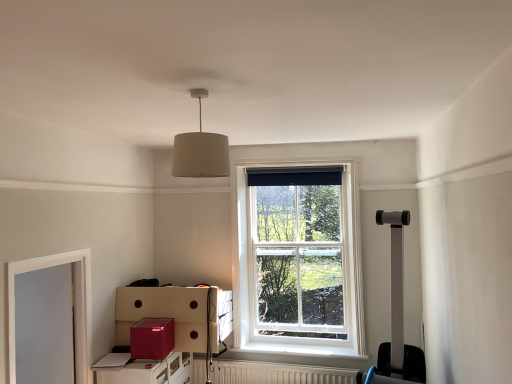
You are a GUI agent. You are given a task and a screenshot of the screen. Output one action in this format:
    pyautogui.click(x=<x>, y=<y>)
    Task: Click on the white textured radiator at lower center
    The width and height of the screenshot is (512, 384).
    Given the screenshot: What is the action you would take?
    pyautogui.click(x=278, y=373)

Where is `white wood frame at left`? The height and width of the screenshot is (384, 512). white wood frame at left is located at coordinates (81, 296).

This screenshot has height=384, width=512. What do you see at coordinates (152, 338) in the screenshot?
I see `glossy cardboard box at lower left` at bounding box center [152, 338].

Where is `beige fabric lampshade at upper center`? Image resolution: width=512 pixels, height=384 pixels. beige fabric lampshade at upper center is located at coordinates (200, 149).

Measure the distance between point (190, 358) and camera.

They are 3.76 meters apart.

This screenshot has height=384, width=512. I want to click on white textured radiator at lower center, so click(278, 373).

Where is `window in front of the dark blue fabric at upper center`? The image size is (512, 384). window in front of the dark blue fabric at upper center is located at coordinates (298, 258).

Is dark blue fabric at upper center inside or outside of white wooden window at center?

dark blue fabric at upper center is enclosed within white wooden window at center.

From the image's perspective, is dark blue fabric at upper center located beneath white wooden window at center?

Incorrect, from the image's perspective, dark blue fabric at upper center is higher than white wooden window at center.

Is dark blue fabric at upper center positioned beyond the bounds of glossy cardboard box at lower left?

Yes, dark blue fabric at upper center is not within glossy cardboard box at lower left.

Between dark blue fabric at upper center and glossy cardboard box at lower left, which one has more height?

glossy cardboard box at lower left.

From the image's perspective, who appears lower, dark blue fabric at upper center or glossy cardboard box at lower left?

glossy cardboard box at lower left.

Measure the distance from dark blue fabric at upper center to glossy cardboard box at lower left.

dark blue fabric at upper center is 5.64 feet away from glossy cardboard box at lower left.

Are white wooden window at center and dark blue fabric at upper center beside each other?

They are not placed beside each other.

Is dark blue fabric at upper center inside white wooden window at center?

Indeed, dark blue fabric at upper center is located within white wooden window at center.

In the scene shown: Is white wooden window at center closer to the viewer compared to dark blue fabric at upper center?

Yes.

Is beige fabric lampshade at upper center shorter than dark blue fabric at upper center?

Incorrect, the height of beige fabric lampshade at upper center does not fall short of that of dark blue fabric at upper center.

Is point (199, 128) in front of point (288, 178)?

Yes, point (199, 128) is closer to viewer.

Is beige fabric lampshade at upper center next to dark blue fabric at upper center?

No.

Locate an element on the screen. The width and height of the screenshot is (512, 384). lamp on the left of dark blue fabric at upper center is located at coordinates (200, 149).

Which is behind, point (226, 163) or point (264, 372)?

The point (264, 372) is farther.

Does beige fabric lampshade at upper center have a larger size compared to white textured radiator at lower center?

No, beige fabric lampshade at upper center is not bigger than white textured radiator at lower center.

Is beige fabric lampshade at upper center in front of or behind white textured radiator at lower center in the image?

In the image, beige fabric lampshade at upper center appears in front of white textured radiator at lower center.

From a real-world perspective, is beige fabric lampshade at upper center positioned above or below white textured radiator at lower center?

In terms of real-world spatial position, beige fabric lampshade at upper center is above white textured radiator at lower center.

In order to click on window above the glossy cardboard box at lower left (from the image's perspective) in this screenshot , I will do `click(298, 258)`.

Could you tell me if white wooden window at center is facing glossy cardboard box at lower left?

No, white wooden window at center does not turn towards glossy cardboard box at lower left.

Is white wooden window at center bigger or smaller than glossy cardboard box at lower left?

Clearly, white wooden window at center is larger in size than glossy cardboard box at lower left.

Is beige fabric lampshade at upper center oriented towards glossy cardboard box at lower left?

No, beige fabric lampshade at upper center is not oriented towards glossy cardboard box at lower left.

Based on the photo, from the image's perspective, which is below, beige fabric lampshade at upper center or glossy cardboard box at lower left?

glossy cardboard box at lower left.

Looking at this image, from a real-world perspective, relative to glossy cardboard box at lower left, is beige fabric lampshade at upper center vertically above or below?

From a real-world perspective, beige fabric lampshade at upper center is physically above glossy cardboard box at lower left.

Is beige fabric lampshade at upper center not close to glossy cardboard box at lower left?

Indeed, beige fabric lampshade at upper center is not near glossy cardboard box at lower left.

Identify the location of curtain behind the white wooden window at center. (295, 176).

You are a GUI agent. You are given a task and a screenshot of the screen. Output one action in this format:
    pyautogui.click(x=<x>, y=<y>)
    Task: Click on the cardboard box in front of the dark blue fabric at upper center
    
    Given the screenshot: What is the action you would take?
    pyautogui.click(x=152, y=338)

From the image, which object appears to be nearer to white wooden window at center, glossy cardboard box at lower left or white textured radiator at lower center?

The object closer to white wooden window at center is white textured radiator at lower center.

Considering their positions, is metallic red file cabinet at lower left positioned closer to dark blue fabric at upper center than glossy cardboard box at lower left?

Based on the image, glossy cardboard box at lower left appears to be nearer to dark blue fabric at upper center.

Based on their spatial positions, is white wooden window at center or glossy cardboard box at lower left closer to dark blue fabric at upper center?

white wooden window at center lies closer to dark blue fabric at upper center than the other object.

Considering their positions, is white wooden window at center positioned closer to metallic red file cabinet at lower left than white wood frame at left?

white wood frame at left lies closer to metallic red file cabinet at lower left than the other object.

When comparing their distances from white wood frame at left, does dark blue fabric at upper center or metallic red file cabinet at lower left seem further?

dark blue fabric at upper center is positioned further to the anchor white wood frame at left.

Looking at the image, which one is located further to white wood frame at left, dark blue fabric at upper center or white textured radiator at lower center?

dark blue fabric at upper center.

From the image, which object appears to be farther from dark blue fabric at upper center, glossy cardboard box at lower left or white wood frame at left?

white wood frame at left is further to dark blue fabric at upper center.

Based on their spatial positions, is beige fabric lampshade at upper center or white wooden window at center further from glossy cardboard box at lower left?

beige fabric lampshade at upper center.

Where is `file cabinet between beige fabric lampshade at upper center and dark blue fabric at upper center from front to back`? Image resolution: width=512 pixels, height=384 pixels. file cabinet between beige fabric lampshade at upper center and dark blue fabric at upper center from front to back is located at coordinates (150, 371).

Locate an element on the screen. radiator between metallic red file cabinet at lower left and white wooden window at center in the horizontal direction is located at coordinates (278, 373).

The width and height of the screenshot is (512, 384). What are the coordinates of `window between glossy cardboard box at lower left and dark blue fabric at upper center` in the screenshot? It's located at (298, 258).

You are a GUI agent. You are given a task and a screenshot of the screen. Output one action in this format:
    pyautogui.click(x=<x>, y=<y>)
    Task: Click on the cardboard box between beige fabric lampshade at upper center and metallic red file cabinet at lower left from top to bottom
    The height and width of the screenshot is (384, 512).
    Given the screenshot: What is the action you would take?
    pyautogui.click(x=152, y=338)